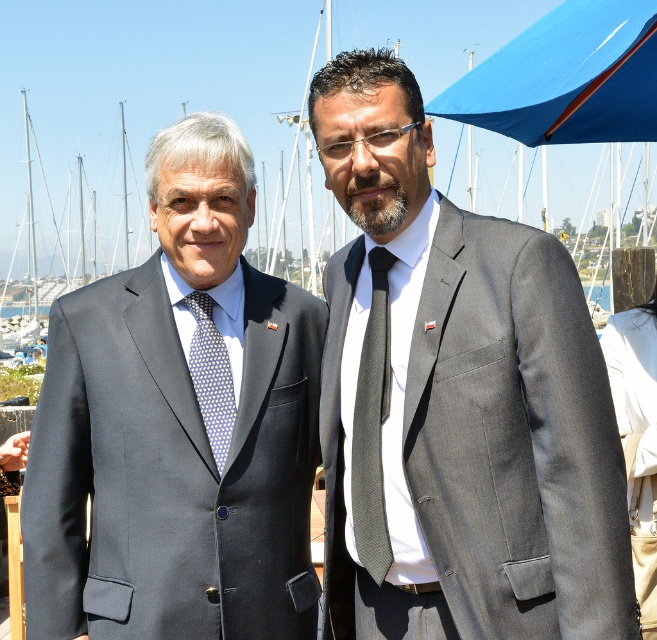
You are a photographer setting up for a group photo. You notice two men wearing ties in the scene. The dark gray textured tie at center and the blue dotted tie at left. Which tie is wider?

The blue dotted tie at left is wider than the dark gray textured tie at center.

You are a photographer standing at the back of the scene. You need to capture a closeup shot of both the dark gray textured tie at center and the blue dotted tie at left in a single frame. Given that your camera has a maximum focus range of 4 feet, will you be able to achieve this?

The dark gray textured tie at center and the blue dotted tie at left are 4.59 feet apart. Since the distance between them exceeds the camera maximum focus range of 4 feet, you cannot capture both in a single closeup frame.

In the scene shown: You are a photographer adjusting your camera settings. You notice a point at coordinates (373, 426) in the image. Which object is this point located on?

The point at coordinates (373, 426) is located on the dark gray textured tie at center.